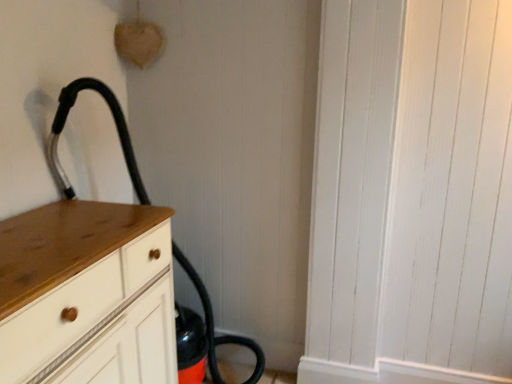
The width and height of the screenshot is (512, 384). I want to click on black rubber garden hose at left, so click(x=117, y=130).

This screenshot has width=512, height=384. Describe the element at coordinates (117, 130) in the screenshot. I see `black rubber garden hose at left` at that location.

Locate an element on the screen. black rubber garden hose at left is located at coordinates (117, 130).